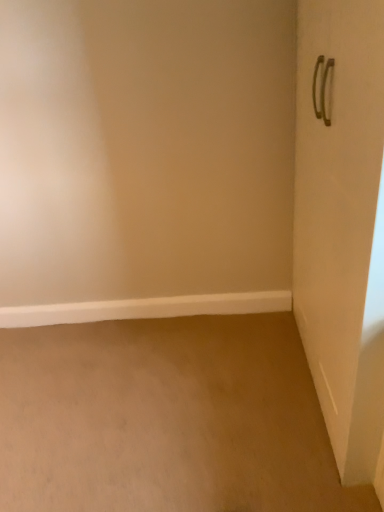
What do you see at coordinates (341, 222) in the screenshot? Image resolution: width=384 pixels, height=512 pixels. I see `metallic silver handle at right` at bounding box center [341, 222].

Locate an element on the screen. metallic silver handle at right is located at coordinates (341, 222).

In order to face metallic silver handle at right, should I rotate leftwards or rightwards?

Turn right by 19.478 degrees to look at metallic silver handle at right.

The height and width of the screenshot is (512, 384). Describe the element at coordinates (146, 308) in the screenshot. I see `white smooth baseboard at lower left` at that location.

The width and height of the screenshot is (384, 512). I want to click on white smooth baseboard at lower left, so click(146, 308).

Locate an element on the screen. metallic silver handle at right is located at coordinates (341, 222).

Which object is positioned more to the left, metallic silver handle at right or white smooth baseboard at lower left?

white smooth baseboard at lower left is more to the left.

Between metallic silver handle at right and white smooth baseboard at lower left, which one is positioned behind?

white smooth baseboard at lower left.

Which point is more distant from viewer, (300, 298) or (197, 298)?

The point (197, 298) is behind.

In the scene shown: From the image's perspective, is metallic silver handle at right above white smooth baseboard at lower left?

Yes, from the image's perspective, metallic silver handle at right is on top of white smooth baseboard at lower left.

From a real-world perspective, is metallic silver handle at right on white smooth baseboard at lower left?

Indeed, from a real-world perspective, metallic silver handle at right stands above white smooth baseboard at lower left.

Can you confirm if metallic silver handle at right is thinner than white smooth baseboard at lower left?

No, metallic silver handle at right is not thinner than white smooth baseboard at lower left.

Considering the sizes of objects metallic silver handle at right and white smooth baseboard at lower left in the image provided, who is taller, metallic silver handle at right or white smooth baseboard at lower left?

metallic silver handle at right is taller.

Does metallic silver handle at right have a larger size compared to white smooth baseboard at lower left?

Yes.

Do you think metallic silver handle at right is within white smooth baseboard at lower left, or outside of it?

metallic silver handle at right is not inside white smooth baseboard at lower left, it's outside.

Is metallic silver handle at right far from white smooth baseboard at lower left?

metallic silver handle at right is positioned a significant distance from white smooth baseboard at lower left.

Is metallic silver handle at right oriented towards white smooth baseboard at lower left?

Yes.

This screenshot has height=512, width=384. In order to click on window sill below the metallic silver handle at right (from the image's perspective) in this screenshot , I will do `click(146, 308)`.

Can you confirm if white smooth baseboard at lower left is positioned to the right of metallic silver handle at right?

No, white smooth baseboard at lower left is not to the right of metallic silver handle at right.

Which object is further away from the camera, white smooth baseboard at lower left or metallic silver handle at right?

white smooth baseboard at lower left is further away from the camera.

Which point is more distant from viewer, (254, 297) or (348, 446)?

The point (254, 297) is more distant.

From the image's perspective, is white smooth baseboard at lower left located beneath metallic silver handle at right?

Yes, from the image's perspective, white smooth baseboard at lower left is below metallic silver handle at right.

In the scene shown: From a real-world perspective, between white smooth baseboard at lower left and metallic silver handle at right, who is vertically lower?

white smooth baseboard at lower left is physically lower.

Considering the sizes of white smooth baseboard at lower left and metallic silver handle at right in the image, is white smooth baseboard at lower left wider or thinner than metallic silver handle at right?

Considering their sizes, white smooth baseboard at lower left looks slimmer than metallic silver handle at right.

Considering the sizes of white smooth baseboard at lower left and metallic silver handle at right in the image, is white smooth baseboard at lower left taller or shorter than metallic silver handle at right?

Clearly, white smooth baseboard at lower left is shorter compared to metallic silver handle at right.

Considering the sizes of white smooth baseboard at lower left and metallic silver handle at right in the image, is white smooth baseboard at lower left bigger or smaller than metallic silver handle at right?

white smooth baseboard at lower left is smaller than metallic silver handle at right.

Would you say white smooth baseboard at lower left contains metallic silver handle at right?

No, metallic silver handle at right is not surrounded by white smooth baseboard at lower left.

Is white smooth baseboard at lower left touching metallic silver handle at right?

There is a gap between white smooth baseboard at lower left and metallic silver handle at right.

Is white smooth baseboard at lower left oriented away from metallic silver handle at right?

No.

The image size is (384, 512). In order to click on door that appears above the white smooth baseboard at lower left (from the image's perspective) in this screenshot , I will do `click(341, 222)`.

Identify the location of door that appears above the white smooth baseboard at lower left (from a real-world perspective). [x=341, y=222].

At what (x,y) coordinates should I click in order to perform the action: click on window sill on the left of metallic silver handle at right. Please return your answer as a coordinate pair (x, y). Looking at the image, I should click on (146, 308).